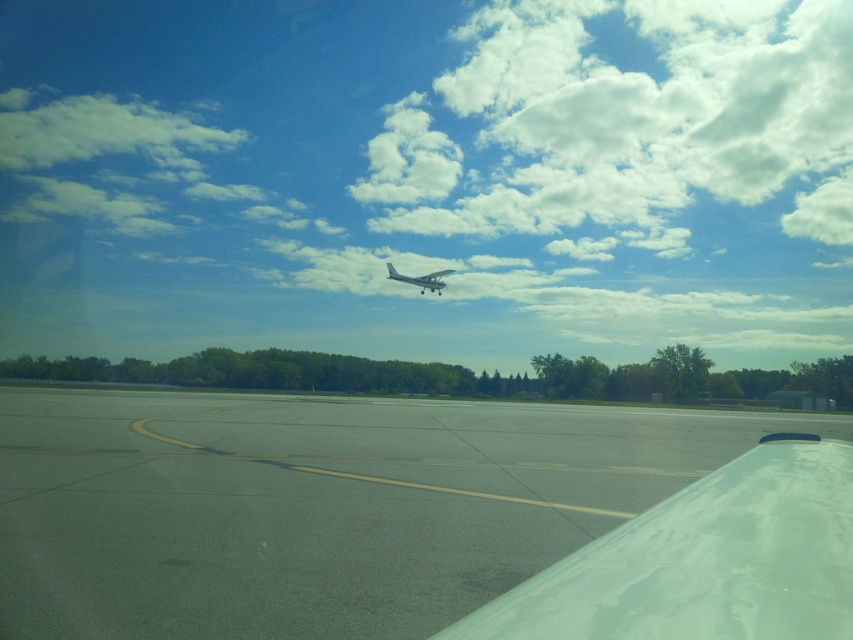
Can you confirm if white fluffy cloud at upper center is positioned above white matte airplane at center?

Correct, white fluffy cloud at upper center is located above white matte airplane at center.

Is white fluffy cloud at upper center shorter than white matte airplane at center?

In fact, white fluffy cloud at upper center may be taller than white matte airplane at center.

Who is more forward, [668,336] or [448,269]?

Point [448,269] is more forward.

The height and width of the screenshot is (640, 853). I want to click on white fluffy cloud at upper center, so click(426, 177).

Is gray asphalt runway at center wider than transparent plastic airplane wing at lower right?

Indeed, gray asphalt runway at center has a greater width compared to transparent plastic airplane wing at lower right.

Does gray asphalt runway at center have a greater height compared to transparent plastic airplane wing at lower right?

Correct, gray asphalt runway at center is much taller as transparent plastic airplane wing at lower right.

At what (x,y) coordinates should I click in order to perform the action: click on gray asphalt runway at center. Please return your answer as a coordinate pair (x, y). This screenshot has width=853, height=640. Looking at the image, I should click on (317, 506).

Looking at this image, is transparent plastic airplane wing at lower right bigger than white matte airplane at center?

Incorrect, transparent plastic airplane wing at lower right is not larger than white matte airplane at center.

Is point (695, 577) positioned behind point (440, 273)?

No, (695, 577) is closer to viewer.

Who is more forward, (x=676, y=540) or (x=387, y=269)?

Positioned in front is point (x=676, y=540).

Locate an element on the screen. transparent plastic airplane wing at lower right is located at coordinates (705, 561).